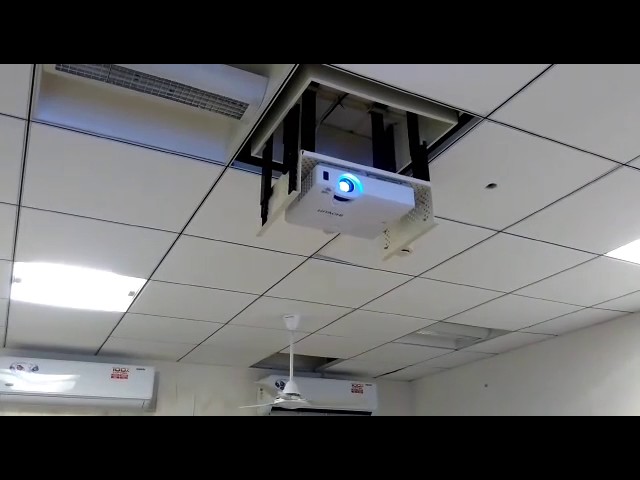
This screenshot has width=640, height=480. What are the coordinates of `walls` in the screenshot? It's located at (211, 399), (477, 392).